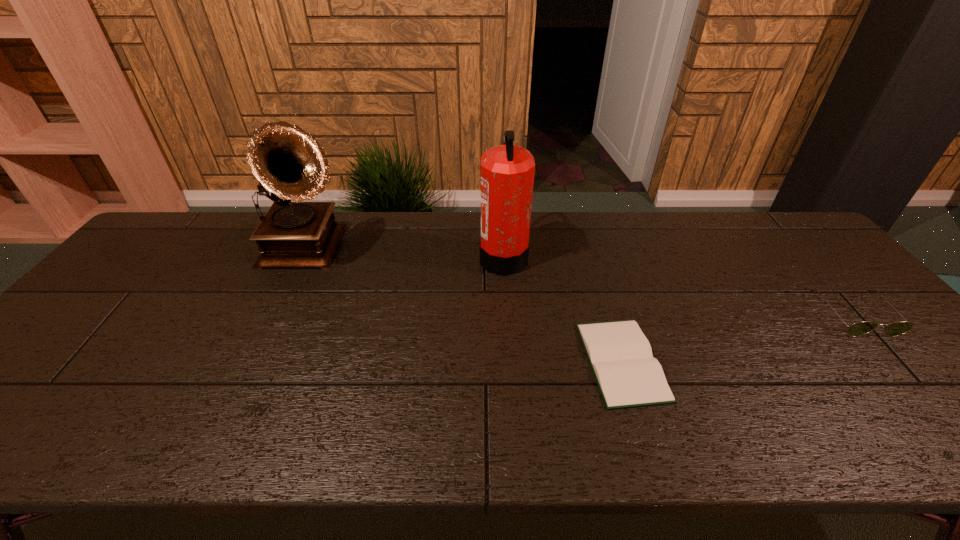
Find the location of a particular element. Image resolution: width=960 pixels, height=540 pixels. free space located on the front-facing side of the sunglasses is located at coordinates (939, 411).

Where is `vacant region located on the back of the shortest object`? The image size is (960, 540). vacant region located on the back of the shortest object is located at coordinates (589, 254).

You are a GUI agent. You are given a task and a screenshot of the screen. Output one action in this format:
    pyautogui.click(x=<x>, y=<y>)
    Task: Click on the fire extinguisher that is at the far edge
    
    Given the screenshot: What is the action you would take?
    pyautogui.click(x=507, y=171)

Find the location of a particular element. record player present at the far edge is located at coordinates (288, 162).

This screenshot has height=540, width=960. In order to click on object present at the right edge in this screenshot , I will do `click(856, 329)`.

In the image, there is a desktop. Identify the location of vacant area at the far edge. (656, 230).

I want to click on vacant space at the near edge of the desktop, so click(x=360, y=438).

This screenshot has height=540, width=960. In the image, there is a desktop. Find the location of `vacant space at the right edge`. vacant space at the right edge is located at coordinates (827, 266).

In the image, there is a desktop. What are the coordinates of `vacant space at the far left corner` in the screenshot? It's located at (207, 211).

The image size is (960, 540). I want to click on vacant region between the third tallest object and the third object from right to left, so click(x=679, y=286).